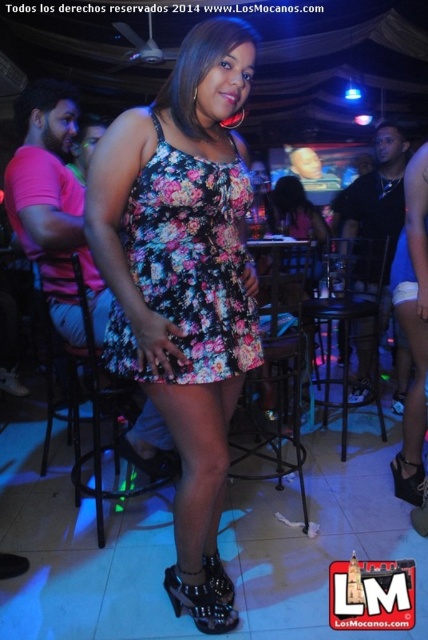
How far apart are floral fabric dress at center and black patent leather sandal at lower center?

floral fabric dress at center is 78.54 centimeters from black patent leather sandal at lower center.

Which is in front, point (89, 212) or point (213, 564)?

Positioned in front is point (89, 212).

Where is `floral fabric dress at center`? This screenshot has width=428, height=640. floral fabric dress at center is located at coordinates (183, 264).

Is point (220, 349) closer to viewer compared to point (216, 556)?

Yes.

Between floral fabric dress at center and black leather high-heeled sandal at lower center, which one is positioned higher?

Positioned higher is floral fabric dress at center.

Find the location of a particular element. This screenshot has width=428, height=640. floral fabric dress at center is located at coordinates 183,264.

Identify the location of floral fabric dress at center. The height and width of the screenshot is (640, 428). (183, 264).

Based on the photo, does black patent leather sandal at lower right appear on the right side of black patent leather sandal at lower center?

Correct, you'll find black patent leather sandal at lower right to the right of black patent leather sandal at lower center.

Does black patent leather sandal at lower right appear on the left side of black patent leather sandal at lower center?

In fact, black patent leather sandal at lower right is to the right of black patent leather sandal at lower center.

What do you see at coordinates (407, 480) in the screenshot? The image size is (428, 640). I see `black patent leather sandal at lower right` at bounding box center [407, 480].

The width and height of the screenshot is (428, 640). In order to click on black patent leather sandal at lower right in this screenshot , I will do `click(407, 480)`.